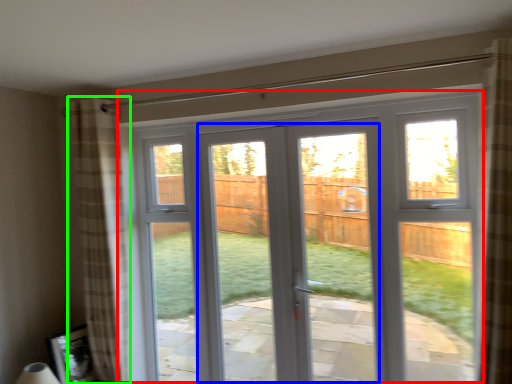
Question: Based on their relative distances, which object is nearer to window (highlighted by a red box)? Choose from screen door (highlighted by a blue box) and curtain (highlighted by a green box).

Choices:
 (A) screen door
 (B) curtain

Answer: (B)